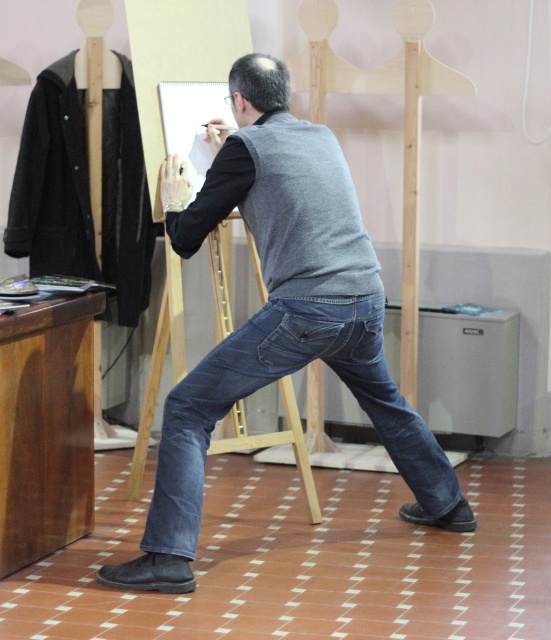
From the picture: You are an artist standing at the easel in the image. You notice two points marked in the scene. Which of the two points, point (x=208, y=216) or point (x=363, y=332), is closer to you?

Point (x=363, y=332) is closer to you because point (x=208, y=216) is behind it.

You are an observer looking at the man in the image. The man is wearing a gray matte vest at center and denim jeans at center. Which article of clothing is positioned to the left?

The gray matte vest at center is to the left of denim jeans at center.

The man in the image is wearing a gray matte vest at center and denim jeans at center. If you were to draw a vertical line down the middle of his torso, which clothing item would be located higher on his body?

The gray matte vest at center is located higher on the man body than the denim jeans at center because it is above the denim jeans at center.